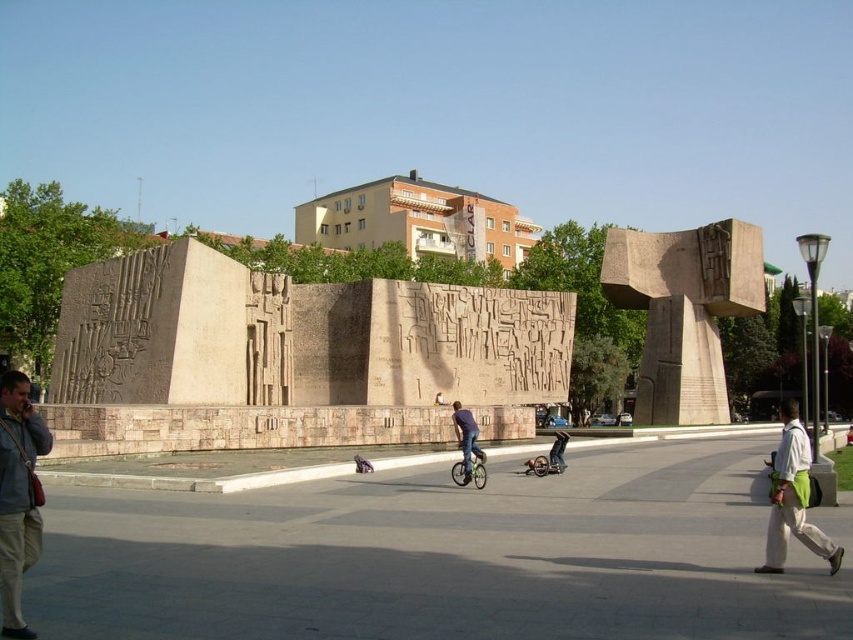
Question: Does white cotton shirt at lower right have a smaller size compared to denim pants at center?

Choices:
 (A) no
 (B) yes

Answer: (A)

Question: Which of the following is the farthest from the observer?

Choices:
 (A) [x=10, y=605]
 (B) [x=772, y=538]
 (C) [x=711, y=307]
 (D) [x=476, y=426]

Answer: (C)

Question: Which of the following is the closest to the observer?

Choices:
 (A) gray fabric jacket at lower left
 (B) white cotton shirt at lower right

Answer: (A)

Question: Which of the following is the closest to the observer?

Choices:
 (A) gray fabric jacket at lower left
 (B) denim pants at center

Answer: (A)

Question: Does gray fabric jacket at lower left have a greater width compared to denim pants at center?

Choices:
 (A) no
 (B) yes

Answer: (B)

Question: Is white cotton shirt at lower right smaller than denim pants at center?

Choices:
 (A) yes
 (B) no

Answer: (B)